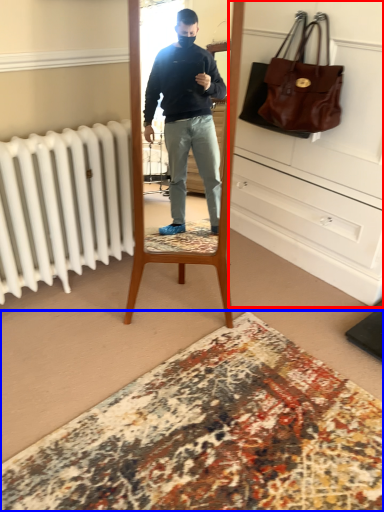
Question: Which point is further to the camera, dresser (highlighted by a red box) or plain (highlighted by a blue box)?

Choices:
 (A) dresser
 (B) plain

Answer: (A)